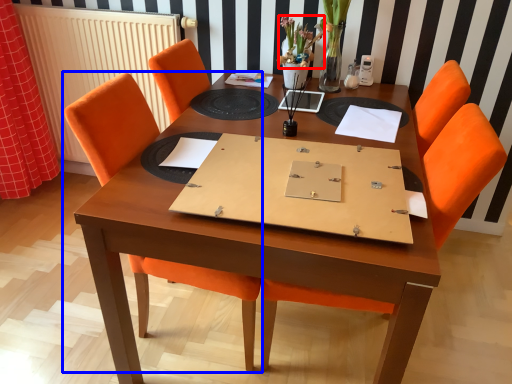
Question: Which point is closer to the camera, flower (highlighted by a red box) or chair (highlighted by a blue box)?

Choices:
 (A) flower
 (B) chair

Answer: (B)